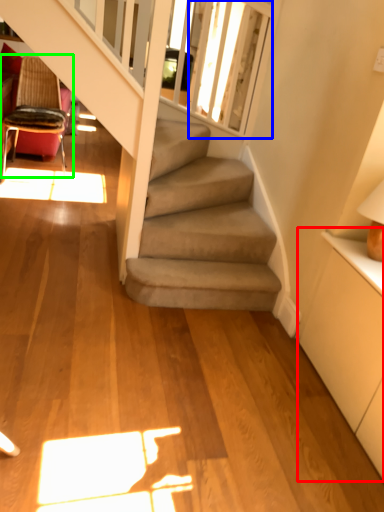
Question: Which is nearer to the dresser (highlighted by a red box)? window screen (highlighted by a blue box) or chair (highlighted by a green box).

Choices:
 (A) window screen
 (B) chair

Answer: (A)